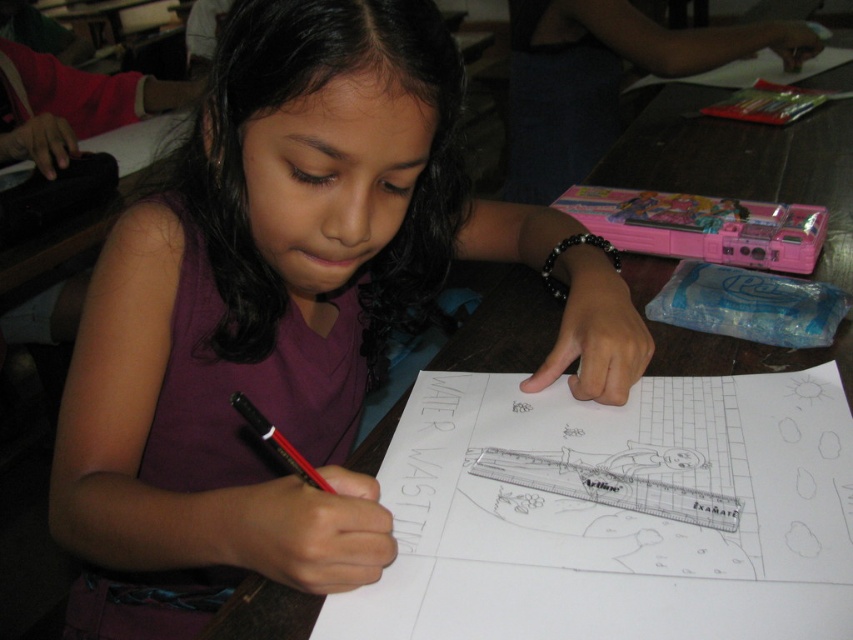
Is matte purple shirt at center to the right of matte black pen at lower center from the viewer's perspective?

No, matte purple shirt at center is not to the right of matte black pen at lower center.

Looking at this image, does matte purple shirt at center appear on the left side of matte black pen at lower center?

Yes, matte purple shirt at center is to the left of matte black pen at lower center.

Image resolution: width=853 pixels, height=640 pixels. Describe the element at coordinates (287, 314) in the screenshot. I see `matte purple shirt at center` at that location.

Locate an element on the screen. This screenshot has width=853, height=640. matte purple shirt at center is located at coordinates (287, 314).